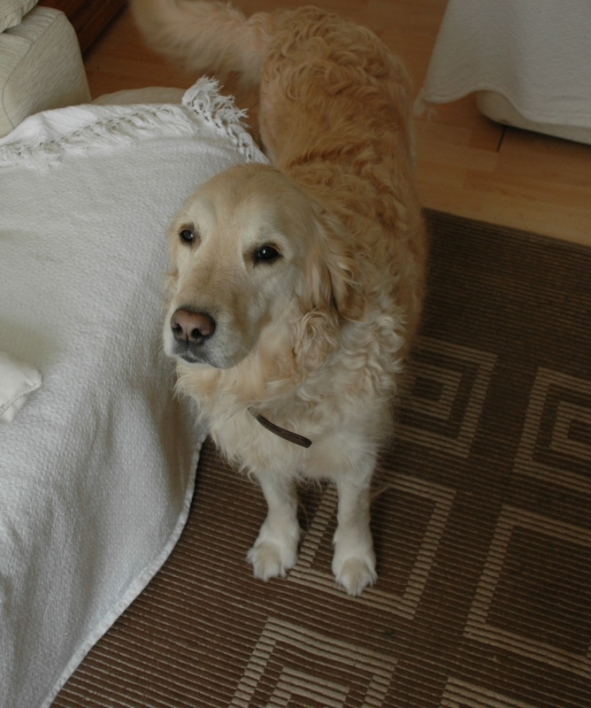
Locate an element on the screen. The height and width of the screenshot is (708, 591). fringe on edge of throw is located at coordinates (207, 91).